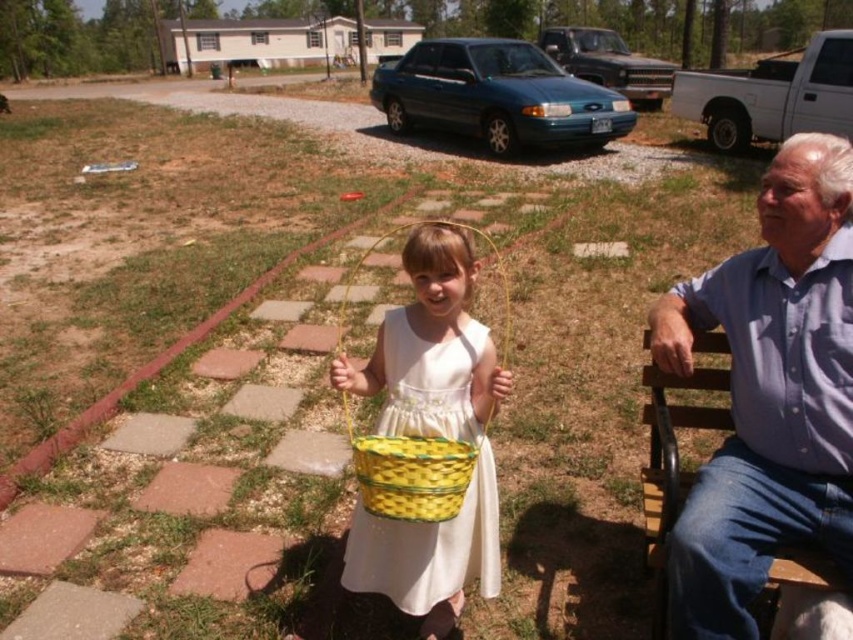
Question: Does blue cotton shirt at right appear under yellow woven basket at center?

Choices:
 (A) no
 (B) yes

Answer: (A)

Question: Does blue cotton shirt at right have a lesser width compared to yellow woven basket at center?

Choices:
 (A) yes
 (B) no

Answer: (B)

Question: Is blue cotton shirt at right below yellow woven basket at center?

Choices:
 (A) no
 (B) yes

Answer: (A)

Question: Which of the following is the farthest from the observer?

Choices:
 (A) yellow woven basket at center
 (B) blue cotton shirt at right

Answer: (A)

Question: Among these objects, which one is farthest from the camera?

Choices:
 (A) yellow woven basket at center
 (B) blue cotton shirt at right

Answer: (A)